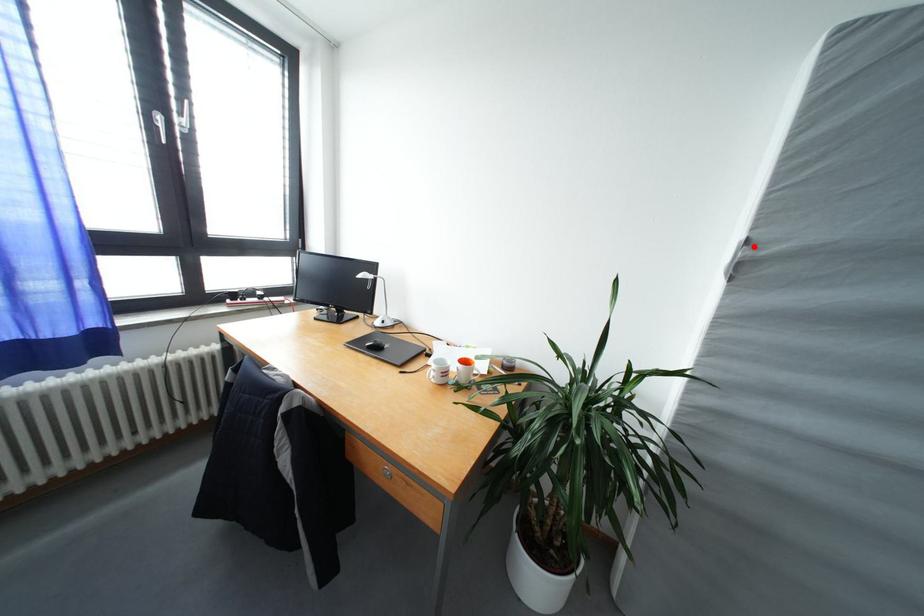
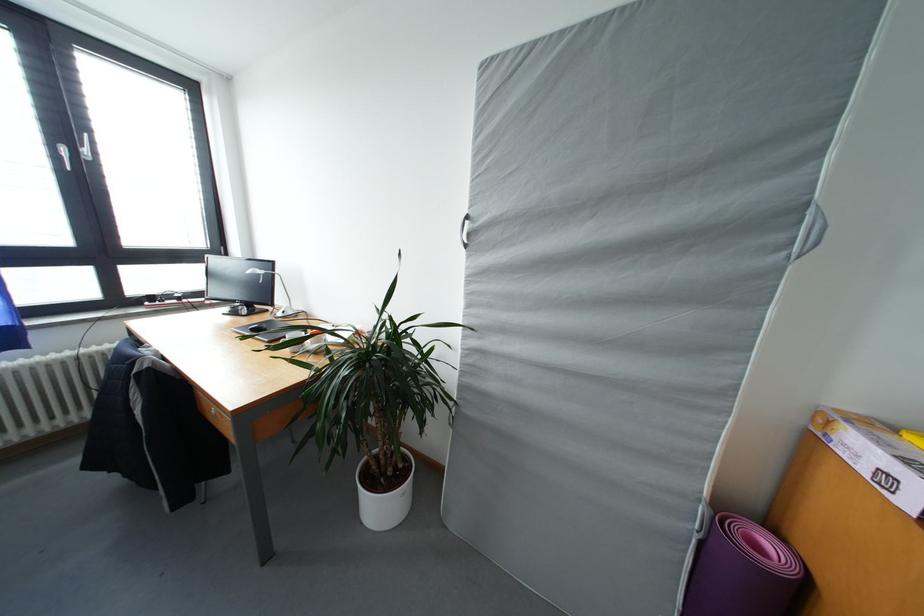
The point at the highlighted location is marked in the first image. Where is the corresponding point in the second image?

(473, 222)